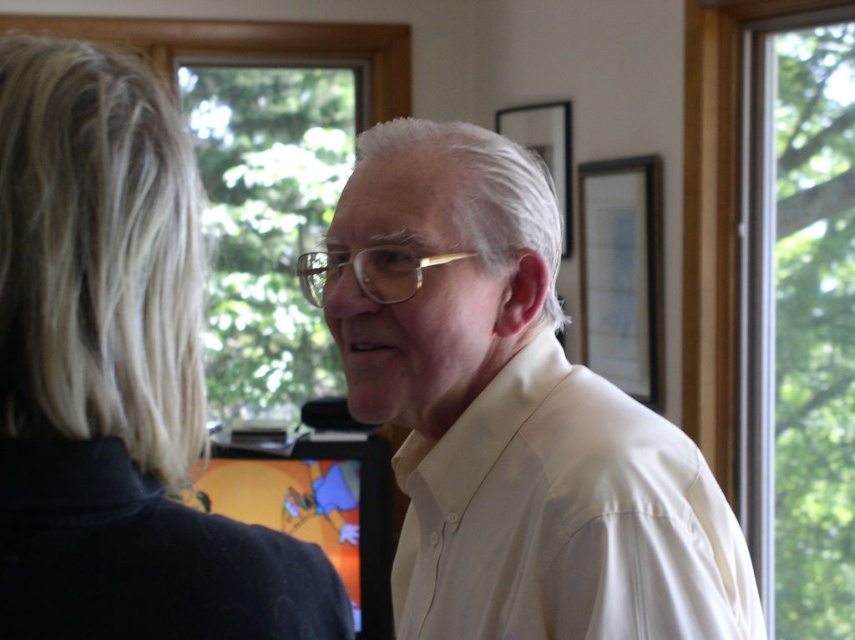
Question: Which object is closer to the camera taking this photo?

Choices:
 (A) white smooth dress shirt at center
 (B) clear glass window at right
 (C) white matte shirt at center

Answer: (C)

Question: Can you confirm if white smooth dress shirt at center is positioned below transparent glass window at upper center?

Choices:
 (A) yes
 (B) no

Answer: (A)

Question: Is blonde hair at left smaller than clear glass window at right?

Choices:
 (A) yes
 (B) no

Answer: (A)

Question: Can you confirm if blonde hair at left is bigger than transparent glass window at upper center?

Choices:
 (A) no
 (B) yes

Answer: (A)

Question: Which of the following is the closest to the observer?

Choices:
 (A) click(x=221, y=198)
 (B) click(x=4, y=580)
 (C) click(x=596, y=637)
 (D) click(x=848, y=310)

Answer: (B)

Question: Which object is closer to the camera taking this photo?

Choices:
 (A) white matte shirt at center
 (B) clear glass window at right
 (C) blonde hair at left
 (D) white smooth dress shirt at center

Answer: (C)